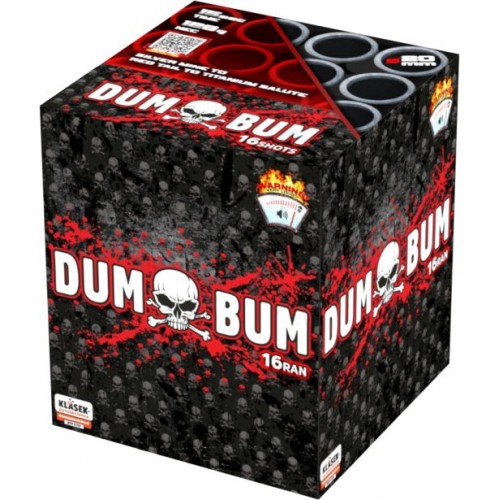
You are a GUI agent. You are given a task and a screenshot of the screen. Output one action in this format:
    pyautogui.click(x=<x>, y=<y>)
    Task: Click on the box
    
    Given the screenshot: What is the action you would take?
    pyautogui.click(x=370, y=383)